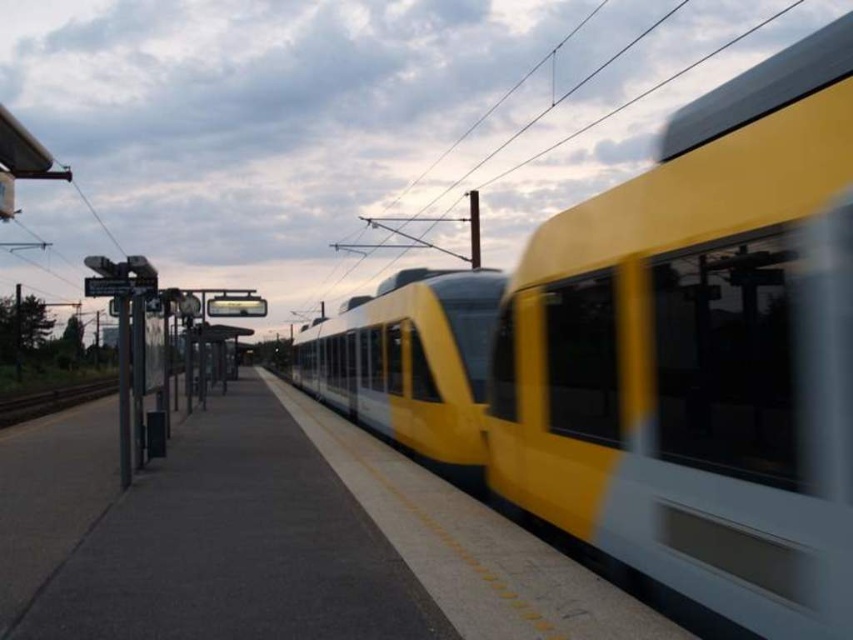
You are waiting at the train station and see the yellow matte train at center and the brown wooden train track at lower left. Which object is closer to you?

The yellow matte train at center is closer to you because it is positioned in front of the brown wooden train track at lower left.

Looking at this image, you are waiting at the train station and see the yellow matte train at center and the smooth concrete platform at center. Which object is positioned to the right side?

The yellow matte train at center is positioned to the right of the smooth concrete platform at center.

You are a passenger waiting on the smooth concrete platform at center. You want to board the yellow matte train at center. Considering the train is shorter than the platform, where should you stand to ensure you can board the train easily?

Since the yellow matte train at center is narrower than the smooth concrete platform at center, you should stand near the middle of the platform to align with the train, as the train is shorter and centered on the platform.